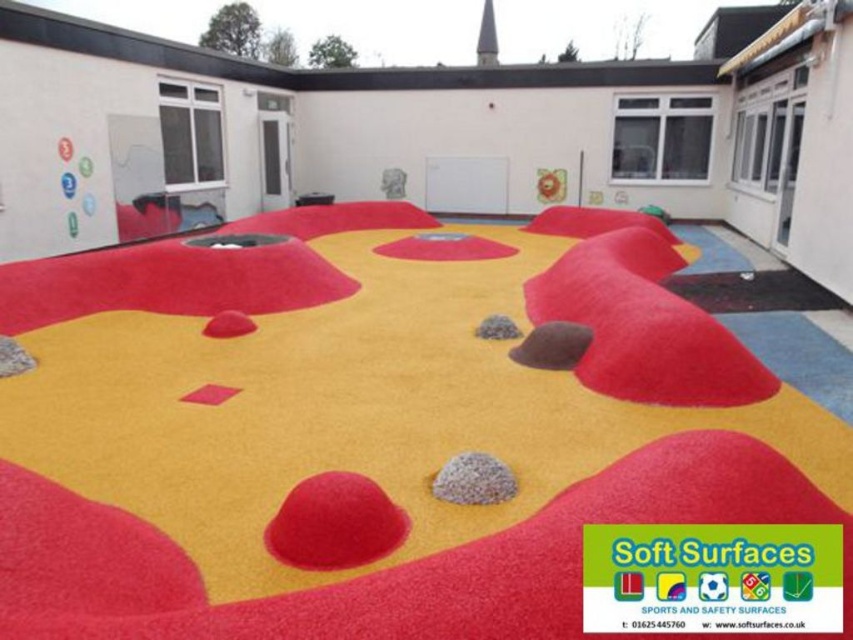
Can you confirm if yellow soft textured mat at center is bigger than gray gravel at center?

Yes.

Can you confirm if yellow soft textured mat at center is wider than gray gravel at center?

Indeed, yellow soft textured mat at center has a greater width compared to gray gravel at center.

Does point (55, 497) come closer to viewer compared to point (492, 316)?

Yes, point (55, 497) is closer to viewer.

Locate an element on the screen. yellow soft textured mat at center is located at coordinates (403, 442).

Which is in front, point (467, 458) or point (503, 339)?

Positioned in front is point (467, 458).

Between point (489, 472) and point (490, 314), which one is positioned in front?

Point (489, 472) is in front.

This screenshot has width=853, height=640. I want to click on gray gravel stone at center, so click(473, 480).

Is yellow soft textured mat at center positioned at the back of brown gravel at center?

No, it is in front of brown gravel at center.

Does yellow soft textured mat at center have a greater width compared to brown gravel at center?

Yes.

I want to click on yellow soft textured mat at center, so click(x=403, y=442).